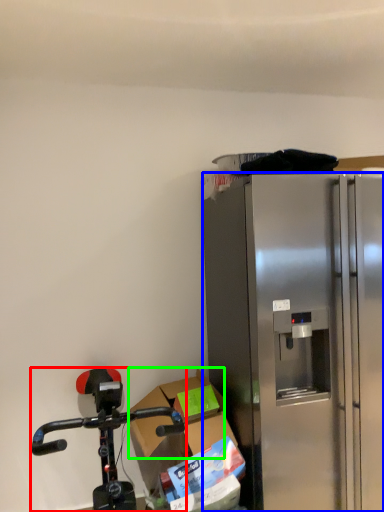
Question: Which object is the closest to the bicycle (highlighted by a red box)? Choose among these: refrigerator (highlighted by a blue box) or box (highlighted by a green box).

Choices:
 (A) refrigerator
 (B) box

Answer: (B)